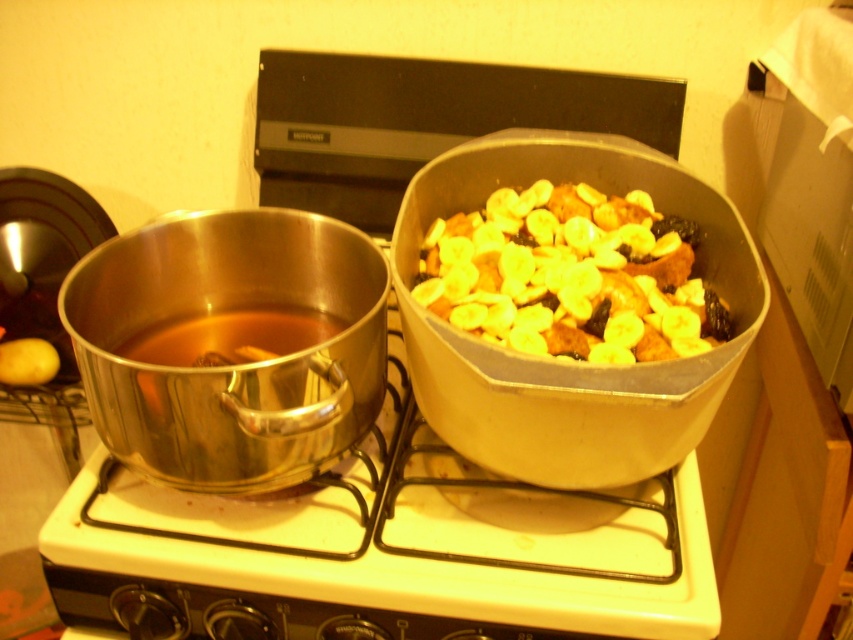
Question: Can you confirm if metallic white gas stove at center is positioned above yellowish matte bananas at center?

Choices:
 (A) yes
 (B) no

Answer: (B)

Question: Which point is farther to the camera?

Choices:
 (A) (537, 205)
 (B) (550, 528)

Answer: (A)

Question: Where is metallic white gas stove at center located in relation to yellowish matte bananas at center in the image?

Choices:
 (A) right
 (B) left

Answer: (B)

Question: Can you confirm if metallic white gas stove at center is positioned to the left of yellowish matte bananas at center?

Choices:
 (A) no
 (B) yes

Answer: (B)